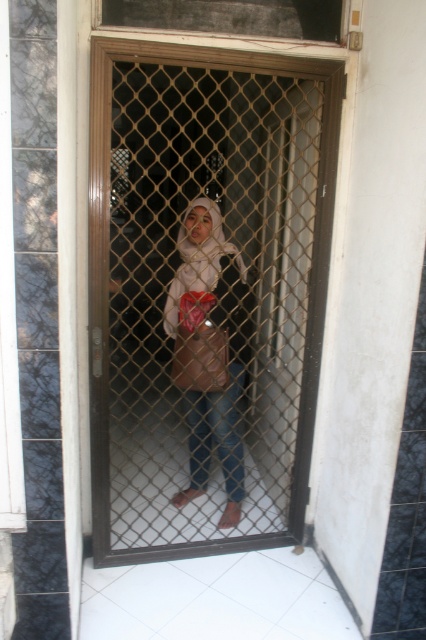
Question: Which point is farther to the camera?

Choices:
 (A) matte beige hijab at center
 (B) metal mesh door at center

Answer: (A)

Question: Does metal mesh door at center come in front of matte beige hijab at center?

Choices:
 (A) yes
 (B) no

Answer: (A)

Question: Does metal mesh door at center have a lesser width compared to matte beige hijab at center?

Choices:
 (A) no
 (B) yes

Answer: (A)

Question: Is the position of metal mesh door at center less distant than that of matte beige hijab at center?

Choices:
 (A) no
 (B) yes

Answer: (B)